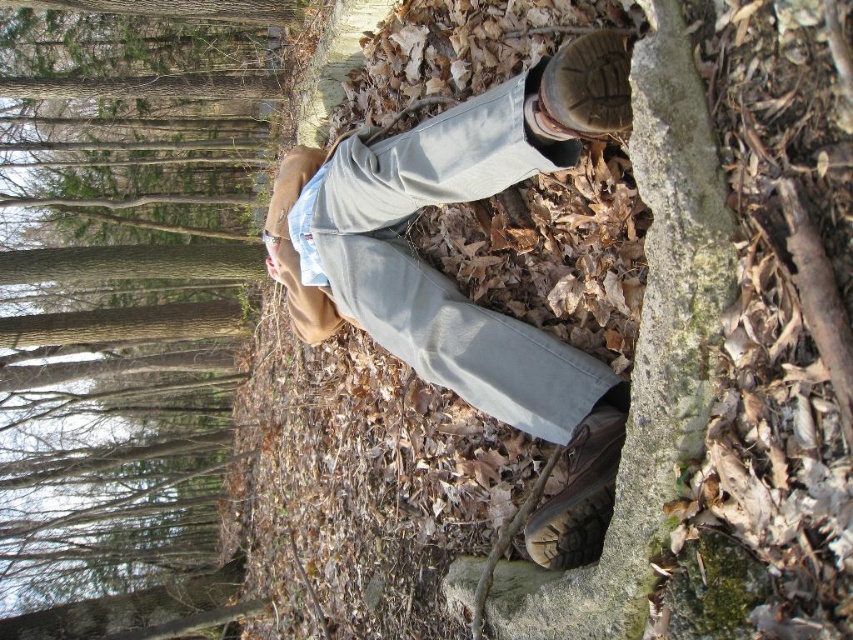
Can you confirm if brown bark tree at upper left is positioned to the right of light gray denim pants at center?

In fact, brown bark tree at upper left is to the left of light gray denim pants at center.

Which is more to the left, brown bark tree at upper left or light gray denim pants at center?

From the viewer's perspective, brown bark tree at upper left appears more on the left side.

Does point (202, 422) lie behind point (450, 138)?

Yes, point (202, 422) is farther from viewer.

Find the location of a particular element. brown bark tree at upper left is located at coordinates (125, 298).